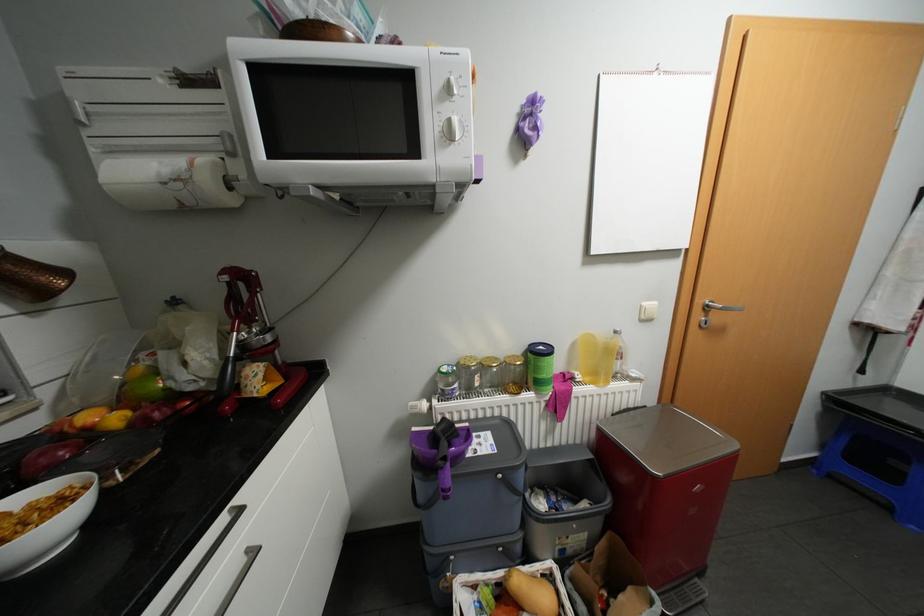
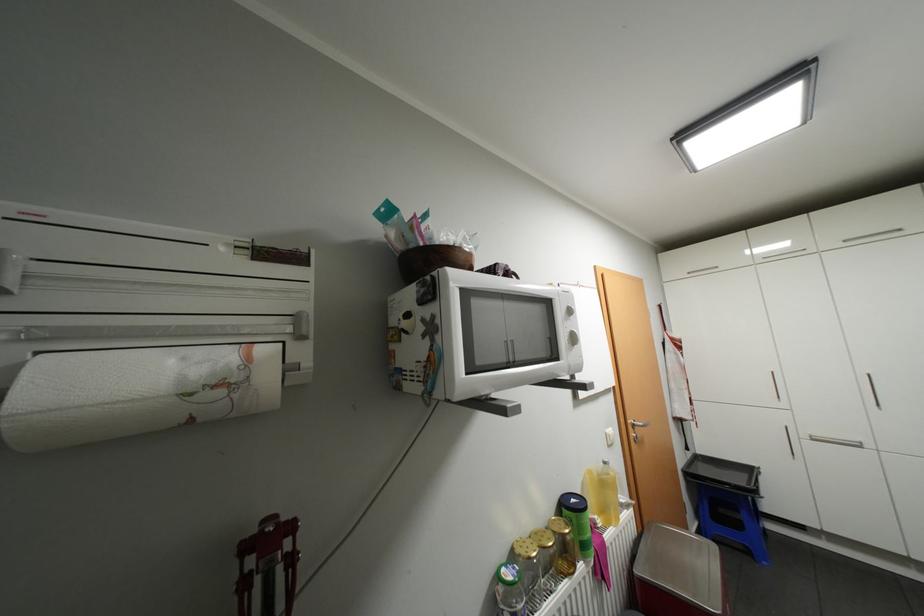
Find the pixel in the second image that matches (x=874, y=379) in the first image.

(697, 453)